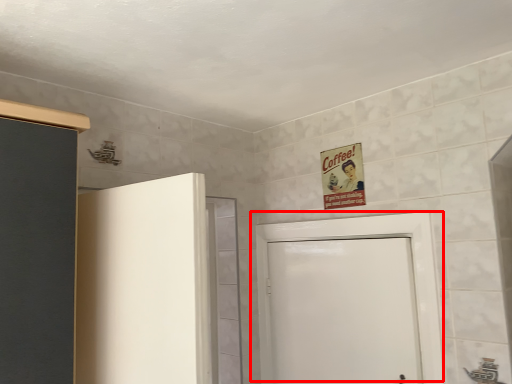
Question: Observing the image, what is the correct spatial positioning of door (annotated by the red box) in reference to poster?

Choices:
 (A) left
 (B) right

Answer: (A)